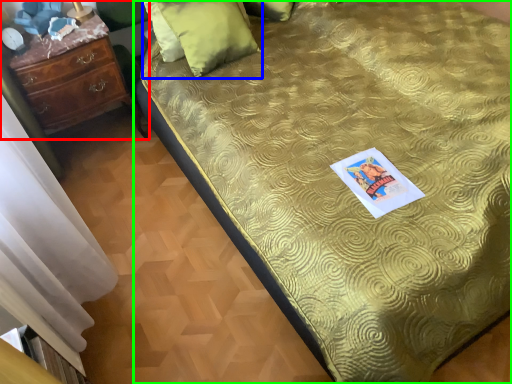
Question: Estimate the real-world distances between objects in this image. Which object is closer to chest of drawers (highlighted by a red box), pillow (highlighted by a blue box) or bed (highlighted by a green box)?

Choices:
 (A) pillow
 (B) bed

Answer: (A)